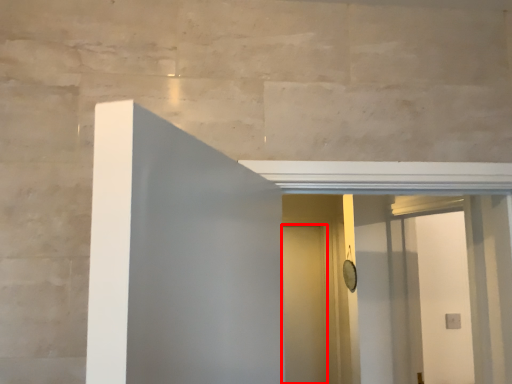
Question: From the image's perspective, where is door (annotated by the red box) located relative to screen door?

Choices:
 (A) below
 (B) above

Answer: (A)